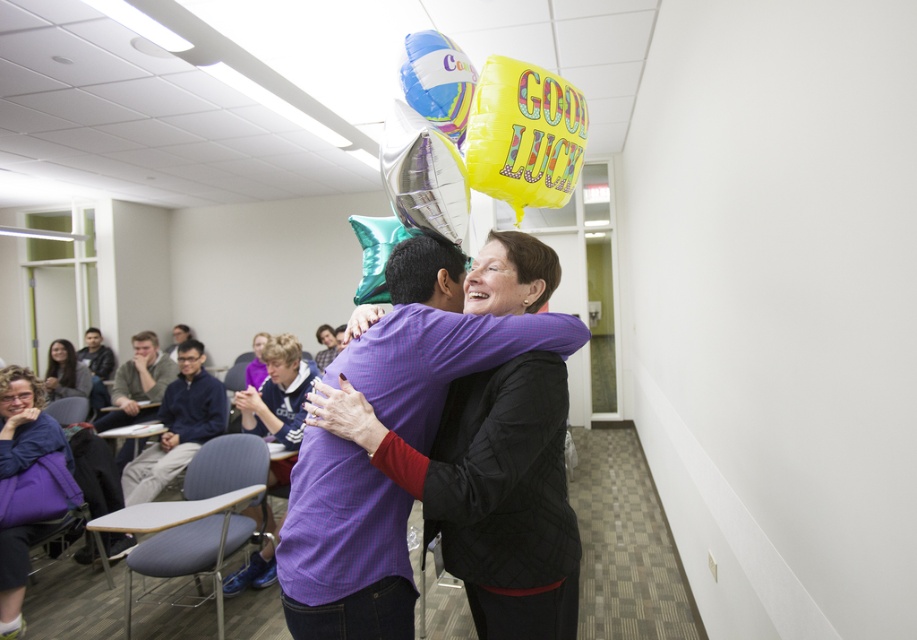
In the scene shown: Is shiny metallic balloon at upper center further to camera compared to dark blue sweater at center?

No.

Consider the image. Is shiny metallic balloon at upper center thinner than dark blue sweater at center?

Indeed, shiny metallic balloon at upper center has a lesser width compared to dark blue sweater at center.

Who is more distant from viewer, (x=462, y=177) or (x=141, y=413)?

The point (x=141, y=413) is more distant.

Identify the location of shiny metallic balloon at upper center. (423, 176).

Is dark blue jacket at left positioned in front of smooth blue hair at center?

No, it is not.

Does dark blue jacket at left have a greater height compared to smooth blue hair at center?

Correct, dark blue jacket at left is much taller as smooth blue hair at center.

What do you see at coordinates (96, 355) in the screenshot? The image size is (917, 640). I see `dark blue jacket at left` at bounding box center [96, 355].

Identify the location of dark blue jacket at left. (96, 355).

Which of these two, purple matte shirt at center or matte black jacket at lower left, stands shorter?

purple matte shirt at center is shorter.

Does purple matte shirt at center have a greater height compared to matte black jacket at lower left?

Incorrect, purple matte shirt at center's height is not larger of matte black jacket at lower left's.

Between point (448, 276) and point (70, 349), which one is positioned behind?

Point (70, 349)

The width and height of the screenshot is (917, 640). In order to click on purple matte shirt at center in this screenshot , I will do `click(426, 273)`.